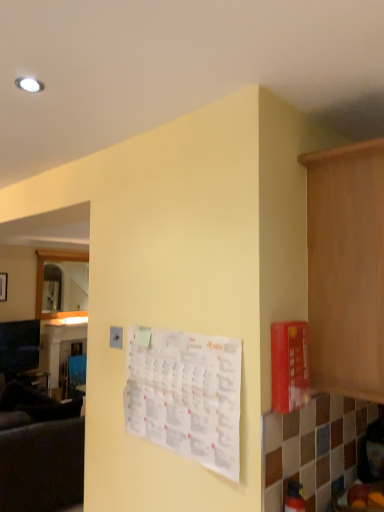
Question: Considering the positions of point (365, 303) and point (225, 349), is point (365, 303) closer or farther from the camera than point (225, 349)?

Choices:
 (A) closer
 (B) farther

Answer: (A)

Question: Looking at the image, does wooden cabinet at right seem bigger or smaller compared to white paper calendar at center?

Choices:
 (A) small
 (B) big

Answer: (B)

Question: Which is farther from the dark gray fabric couch at left?

Choices:
 (A) white paper calendar at center
 (B) wooden cabinet at right

Answer: (B)

Question: Which of these objects is positioned closest to the white paper calendar at center?

Choices:
 (A) wooden cabinet at right
 (B) dark gray fabric couch at left

Answer: (A)